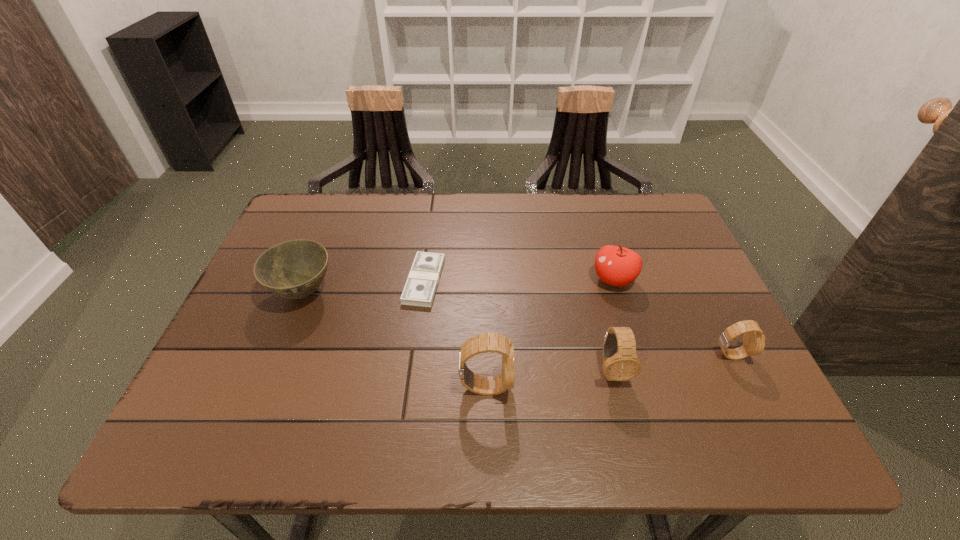
Identify the location of the tallest object. (491, 342).

At what (x,y) coordinates should I click in order to perform the action: click on the fourth object from right to left. Please return your answer as a coordinate pair (x, y). This screenshot has height=540, width=960. Looking at the image, I should click on [x=491, y=342].

Locate an element on the screen. This screenshot has width=960, height=540. the second shortest watch is located at coordinates (620, 362).

At what (x,y) coordinates should I click in order to perform the action: click on the rightmost watch. Please return your answer as a coordinate pair (x, y). The height and width of the screenshot is (540, 960). Looking at the image, I should click on (753, 338).

Locate an element on the screen. the rightmost object is located at coordinates (753, 338).

The image size is (960, 540). I want to click on bowl, so click(294, 269).

Find the location of a particular element. The width and height of the screenshot is (960, 540). dollar is located at coordinates (422, 281).

Identify the location of the second object from left to right. Image resolution: width=960 pixels, height=540 pixels. click(422, 281).

The image size is (960, 540). What are the coordinates of `apple` in the screenshot? It's located at (617, 266).

The height and width of the screenshot is (540, 960). I want to click on free region located 0.130m on the face of the tallest object, so click(x=575, y=387).